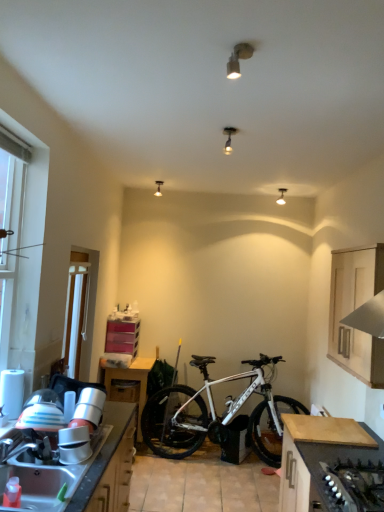
Question: From the image's perspective, relative to dark wood countertop at lower right, the 1th cabinetry ordered from the bottom, is white plastic screen door at left above or below?

Choices:
 (A) above
 (B) below

Answer: (A)

Question: Looking at the image, does white plastic screen door at left seem bigger or smaller compared to dark wood countertop at lower right, which appears as the 2th cabinetry when viewed from the top?

Choices:
 (A) small
 (B) big

Answer: (A)

Question: Estimate the real-world distances between objects in this image. Which object is closer to the wooden table at lower left?

Choices:
 (A) white plastic screen door at left
 (B) matte silver spotlight at upper center, the third lamp in the right-to-left sequence
 (C) metallic stainless steel sink at lower left
 (D) black matte gas stove at lower right
 (E) wooden drawer at lower left

Answer: (E)

Question: Considering the real-world distances, which object is closest to the white plastic window at left?

Choices:
 (A) metallic stainless steel sink at lower left
 (B) wooden drawer at lower left
 (C) white matte bicycle at center
 (D) black matte gas stove at lower right
 (E) dark wood countertop at lower right, which appears as the 2th cabinetry when viewed from the top

Answer: (A)